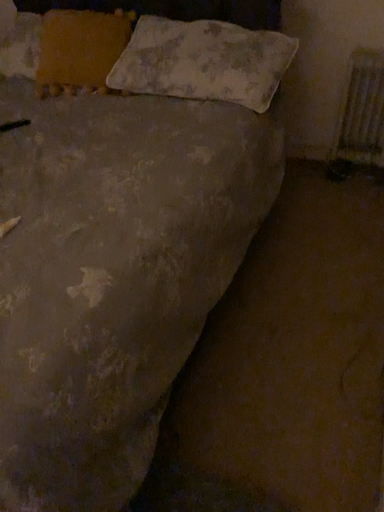
Question: Considering the positions of metallic silver radiator at right and orange fabric pillow at upper left, which ranks as the 2th pillow in right-to-left order, in the image, is metallic silver radiator at right wider or thinner than orange fabric pillow at upper left, which ranks as the 2th pillow in right-to-left order,?

Choices:
 (A) thin
 (B) wide

Answer: (A)

Question: Considering the positions of point (357, 119) and point (102, 47), is point (357, 119) closer or farther from the camera than point (102, 47)?

Choices:
 (A) farther
 (B) closer

Answer: (A)

Question: Which of these objects is positioned farthest from the metallic silver radiator at right?

Choices:
 (A) textured beige pillow at upper center, the first pillow positioned from the right
 (B) orange fabric pillow at upper left, which ranks as the 2th pillow in right-to-left order

Answer: (B)

Question: Which object is positioned farthest from the orange fabric pillow at upper left, acting as the first pillow starting from the left?

Choices:
 (A) textured beige pillow at upper center, the first pillow positioned from the right
 (B) metallic silver radiator at right

Answer: (B)